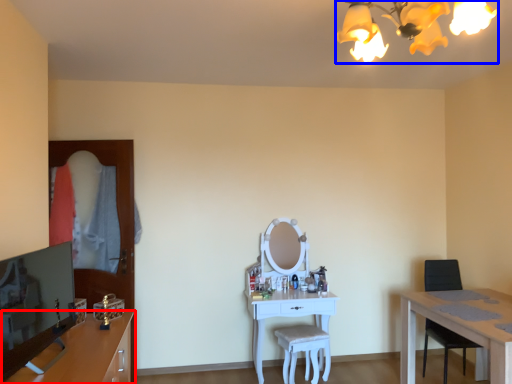
Question: Which of the following is the closest to the observer, cabinetry (highlighted by a red box) or light fixture (highlighted by a blue box)?

Choices:
 (A) cabinetry
 (B) light fixture

Answer: (B)